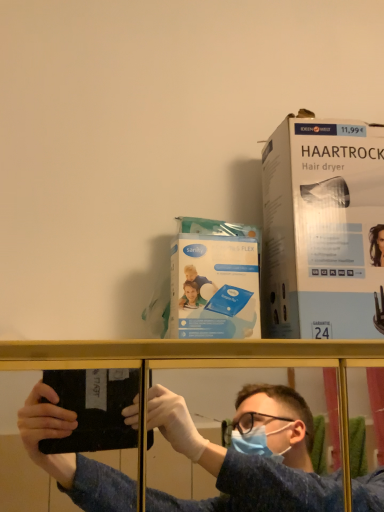
Question: Is blue fabric shirt at center in front of white cardboard box at upper right, marked as the first paperback book in a right-to-left arrangement?

Choices:
 (A) yes
 (B) no

Answer: (A)

Question: Is blue fabric shirt at center located outside white cardboard box at upper right, marked as the first paperback book in a right-to-left arrangement?

Choices:
 (A) yes
 (B) no

Answer: (A)

Question: Is blue fabric shirt at center facing away from white cardboard box at upper right, the 2th paperback book in the left-to-right sequence?

Choices:
 (A) no
 (B) yes

Answer: (A)

Question: From the image's perspective, is blue fabric shirt at center beneath white cardboard box at upper right, marked as the first paperback book in a right-to-left arrangement?

Choices:
 (A) yes
 (B) no

Answer: (A)

Question: Is blue fabric shirt at center aimed at white cardboard box at upper right, the 2th paperback book in the left-to-right sequence?

Choices:
 (A) no
 (B) yes

Answer: (A)

Question: From a real-world perspective, is blue fabric shirt at center positioned under white cardboard box at upper right, the 2th paperback book in the left-to-right sequence, based on gravity?

Choices:
 (A) yes
 (B) no

Answer: (A)

Question: Is white cardboard box at upper right, the 2th paperback book in the left-to-right sequence, oriented towards blue plastic sanitary pads at center, the first paperback book positioned from the left?

Choices:
 (A) yes
 (B) no

Answer: (B)

Question: Considering the relative sizes of white cardboard box at upper right, marked as the first paperback book in a right-to-left arrangement, and blue plastic sanitary pads at center, positioned as the 2th paperback book in right-to-left order, in the image provided, is white cardboard box at upper right, marked as the first paperback book in a right-to-left arrangement, wider than blue plastic sanitary pads at center, positioned as the 2th paperback book in right-to-left order,?

Choices:
 (A) yes
 (B) no

Answer: (A)

Question: Is white cardboard box at upper right, marked as the first paperback book in a right-to-left arrangement, looking in the opposite direction of blue plastic sanitary pads at center, the first paperback book positioned from the left?

Choices:
 (A) yes
 (B) no

Answer: (B)

Question: From a real-world perspective, is white cardboard box at upper right, marked as the first paperback book in a right-to-left arrangement, located beneath blue plastic sanitary pads at center, positioned as the 2th paperback book in right-to-left order?

Choices:
 (A) yes
 (B) no

Answer: (B)

Question: Is white cardboard box at upper right, the 2th paperback book in the left-to-right sequence, far away from blue plastic sanitary pads at center, positioned as the 2th paperback book in right-to-left order?

Choices:
 (A) no
 (B) yes

Answer: (A)

Question: Considering the relative sizes of white cardboard box at upper right, marked as the first paperback book in a right-to-left arrangement, and blue plastic sanitary pads at center, positioned as the 2th paperback book in right-to-left order, in the image provided, is white cardboard box at upper right, marked as the first paperback book in a right-to-left arrangement, bigger than blue plastic sanitary pads at center, positioned as the 2th paperback book in right-to-left order,?

Choices:
 (A) yes
 (B) no

Answer: (A)

Question: Does blue fabric shirt at center have a greater width compared to blue plastic sanitary pads at center, the first paperback book positioned from the left?

Choices:
 (A) no
 (B) yes

Answer: (B)